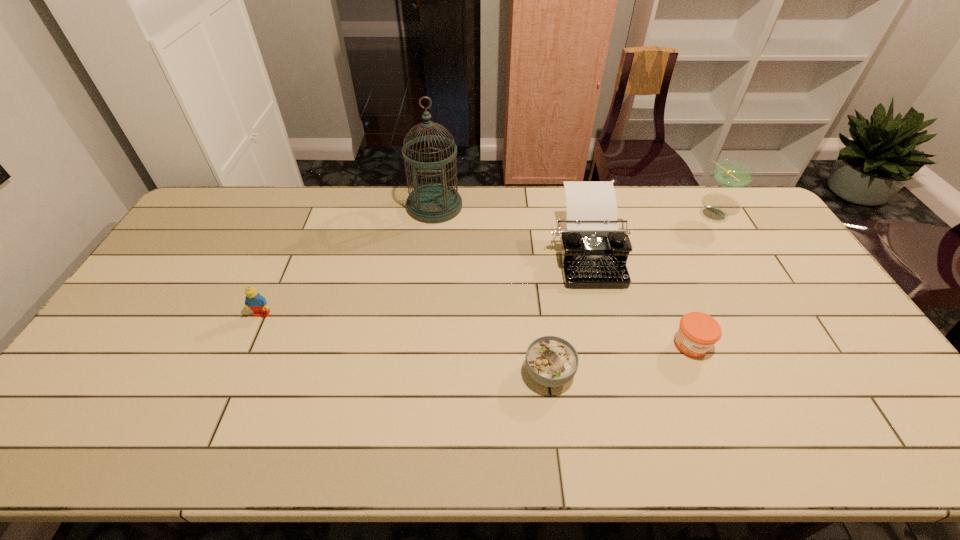
You are a GUI agent. You are given a task and a screenshot of the screen. Output one action in this format:
    pyautogui.click(x=<x>, y=<y>)
    Task: Click on the vacant space at the far edge of the desktop
    
    Given the screenshot: What is the action you would take?
    pyautogui.click(x=676, y=211)

Find the location of a particular element. free space at the near edge of the desktop is located at coordinates (369, 420).

The width and height of the screenshot is (960, 540). In the image, there is a desktop. What are the coordinates of `vacant space at the left edge` in the screenshot? It's located at tap(185, 302).

Find the location of a particular element. This screenshot has width=960, height=540. free location at the right edge is located at coordinates (788, 310).

This screenshot has width=960, height=540. Identify the location of vacant area that lies between the martini and the soup bowl. (632, 294).

Identify the location of free point between the soup bowl and the second object from right to left. (620, 359).

The height and width of the screenshot is (540, 960). Find the location of `vacant area that lies between the rightmost object and the third tallest object`. vacant area that lies between the rightmost object and the third tallest object is located at coordinates (650, 234).

Locate an element on the screen. free space that is in between the soup bowl and the fourth tallest object is located at coordinates 406,343.

Where is `free space between the third nearest object and the typewriter`? free space between the third nearest object and the typewriter is located at coordinates (424, 284).

Identify the location of empty space between the fifth object from right to left and the jam. This screenshot has height=540, width=960. (563, 275).